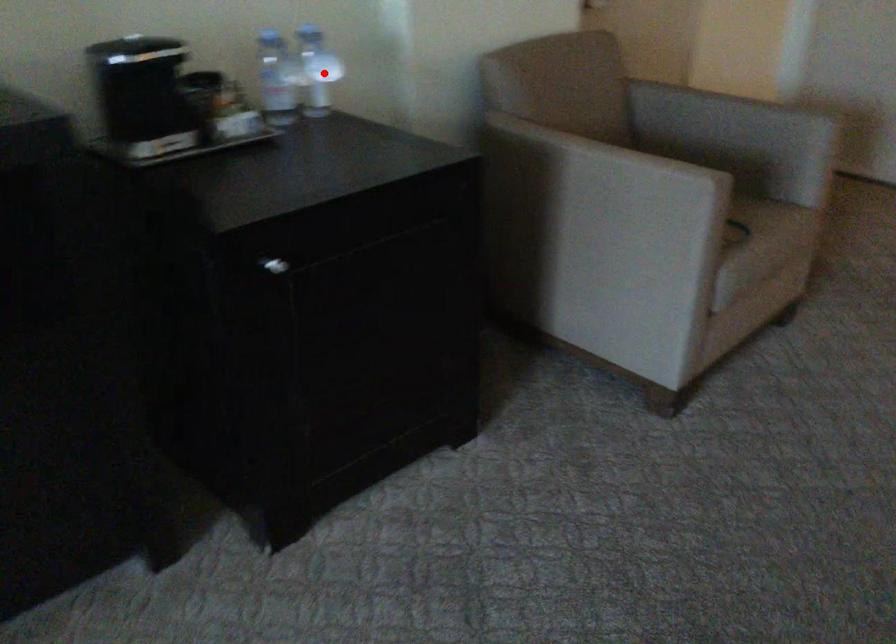
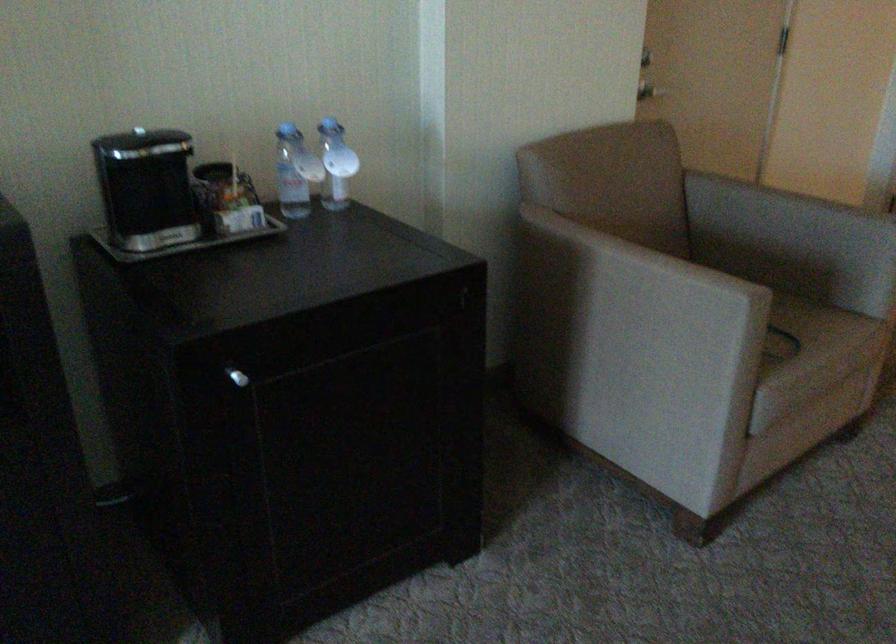
Find the pixel in the second image that matches the highlighted location in the first image.

(336, 164)